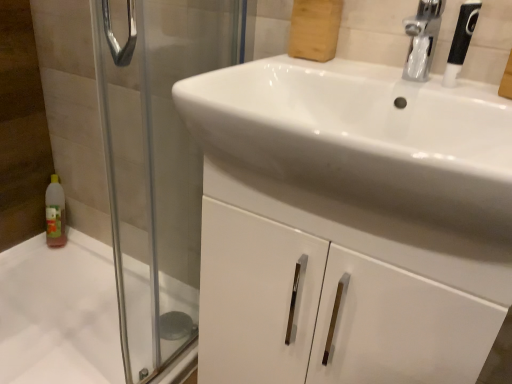
Question: Considering the positions of black textured shower head at upper right and white glossy cabinet at center in the image, is black textured shower head at upper right bigger or smaller than white glossy cabinet at center?

Choices:
 (A) small
 (B) big

Answer: (A)

Question: Is point [459, 16] closer or farther from the camera than point [264, 254]?

Choices:
 (A) closer
 (B) farther

Answer: (B)

Question: Considering the real-world distances, which object is closest to the white glossy cabinet at center?

Choices:
 (A) black textured shower head at upper right
 (B) white glossy bath at lower left
 (C) white glossy sink at center
 (D) transparent glass screen door at left

Answer: (C)

Question: Which of these objects is positioned farthest from the white glossy sink at center?

Choices:
 (A) white glossy cabinet at center
 (B) white glossy bath at lower left
 (C) black textured shower head at upper right
 (D) transparent glass screen door at left

Answer: (B)